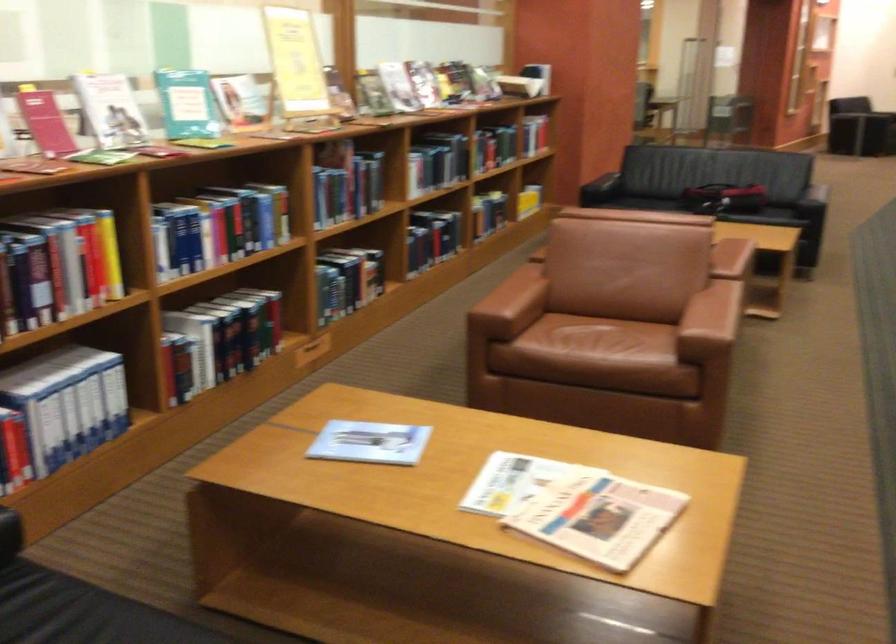
This screenshot has width=896, height=644. What do you see at coordinates (312, 351) in the screenshot?
I see `the recessed drawer pull` at bounding box center [312, 351].